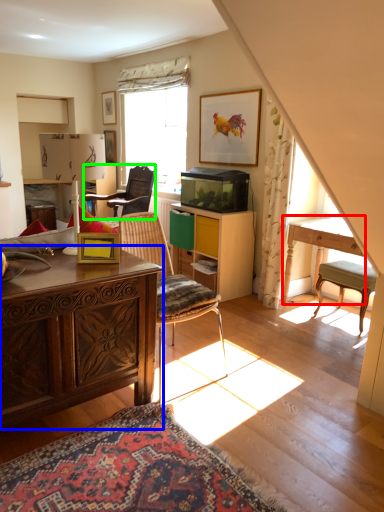
Question: Based on their relative distances, which object is nearer to table (highlighted by a red box)? Choose from desk (highlighted by a blue box) and chair (highlighted by a green box).

Choices:
 (A) desk
 (B) chair

Answer: (A)